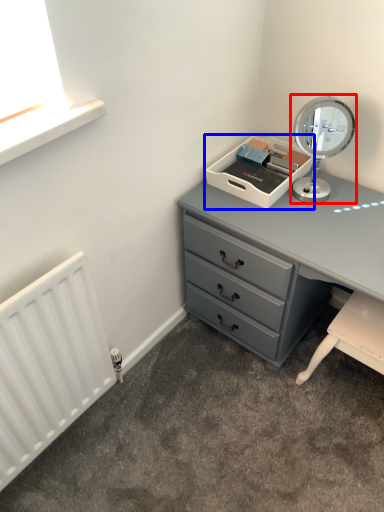
Question: Which object appears closest to the camera in this image, table lamp (highlighted by a red box) or printer (highlighted by a blue box)?

Choices:
 (A) table lamp
 (B) printer

Answer: (A)